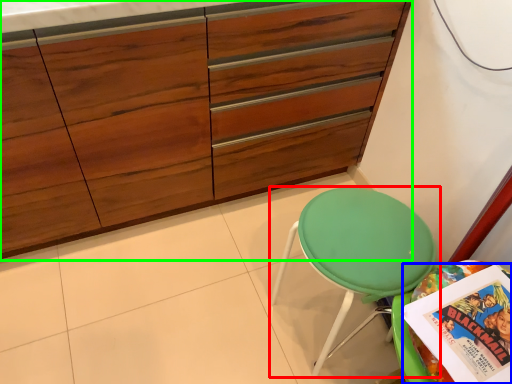
Question: Which object is positioned farthest from chair (highlighted by a red box)? Select from comic book (highlighted by a blue box) and cabinetry (highlighted by a green box).

Choices:
 (A) comic book
 (B) cabinetry

Answer: (B)